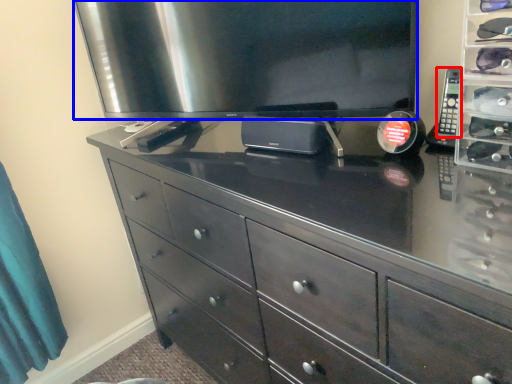
Question: Which object is closer to the camera taking this photo, control (highlighted by a red box) or television (highlighted by a blue box)?

Choices:
 (A) control
 (B) television

Answer: (B)